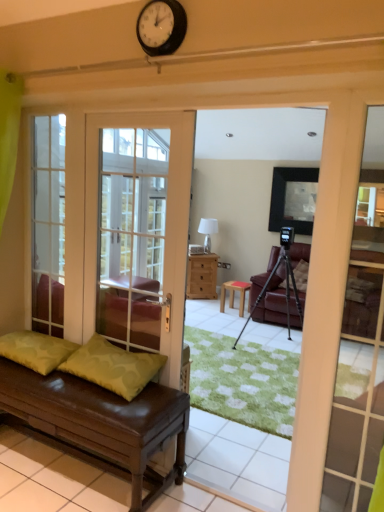
Question: Is clear glass door at left taller or shorter than white face clock at upper center?

Choices:
 (A) short
 (B) tall

Answer: (B)

Question: Do you think clear glass door at left is within white face clock at upper center, or outside of it?

Choices:
 (A) inside
 (B) outside

Answer: (B)

Question: Which object is positioned farthest from the green fabric pillow at lower left, positioned as the second pillow in left-to-right order?

Choices:
 (A) matte black frame at upper center
 (B) brown leather bench at lower left
 (C) green textured pillow at lower left, the first pillow positioned from the left
 (D) white face clock at upper center
 (E) clear glass door at left

Answer: (A)

Question: Which object is the farthest from the green fabric pillow at lower left, which ranks as the first pillow in right-to-left order?

Choices:
 (A) white glass door at left
 (B) matte black frame at upper center
 (C) leather couch at center
 (D) clear glass door at left
 (E) wooden stool at center

Answer: (B)